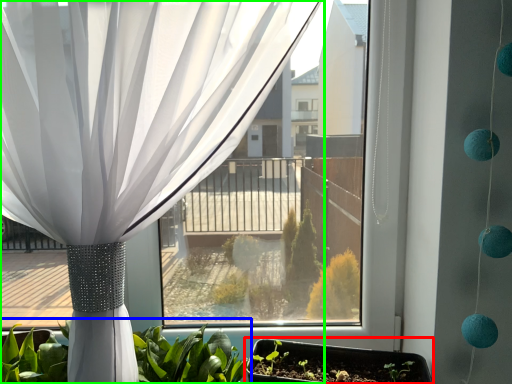
Question: Based on their relative distances, which object is farther from flowerpot (highlighted by a red box)? Choose from houseplant (highlighted by a blue box) and curtain (highlighted by a green box).

Choices:
 (A) houseplant
 (B) curtain

Answer: (B)